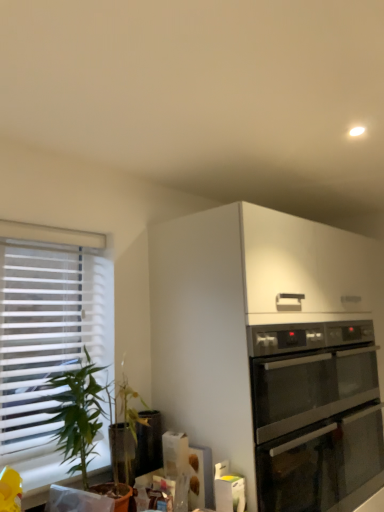
Question: Could you tell me if green leafy plant at left is turned towards satin silver oven at upper right?

Choices:
 (A) yes
 (B) no

Answer: (B)

Question: From a real-world perspective, is green leafy plant at left on top of satin silver oven at upper right?

Choices:
 (A) no
 (B) yes

Answer: (B)

Question: Can you confirm if green leafy plant at left is positioned to the left of satin silver oven at upper right?

Choices:
 (A) yes
 (B) no

Answer: (A)

Question: Can you confirm if green leafy plant at left is shorter than satin silver oven at upper right?

Choices:
 (A) no
 (B) yes

Answer: (B)

Question: Considering the relative sizes of green leafy plant at left and satin silver oven at upper right in the image provided, is green leafy plant at left taller than satin silver oven at upper right?

Choices:
 (A) no
 (B) yes

Answer: (A)

Question: Is satin silver oven at upper right in front of or behind white blinds at left in the image?

Choices:
 (A) front
 (B) behind

Answer: (B)

Question: Is satin silver oven at upper right taller or shorter than white blinds at left?

Choices:
 (A) short
 (B) tall

Answer: (A)

Question: Is satin silver oven at upper right wider or thinner than white blinds at left?

Choices:
 (A) wide
 (B) thin

Answer: (A)

Question: In the image, is satin silver oven at upper right on the left side or the right side of white blinds at left?

Choices:
 (A) right
 (B) left

Answer: (A)

Question: Is point (91, 443) closer or farther from the camera than point (49, 402)?

Choices:
 (A) farther
 (B) closer

Answer: (B)

Question: Considering their positions, is green leafy plant at left located in front of or behind white blinds at left?

Choices:
 (A) front
 (B) behind

Answer: (A)

Question: Looking at the image, does green leafy plant at left seem bigger or smaller compared to white blinds at left?

Choices:
 (A) small
 (B) big

Answer: (B)

Question: Visually, is green leafy plant at left positioned to the left or to the right of white blinds at left?

Choices:
 (A) right
 (B) left

Answer: (A)

Question: From a real-world perspective, is stainless steel oven at lower right positioned above or below satin silver oven at upper right?

Choices:
 (A) below
 (B) above

Answer: (B)

Question: Is stainless steel oven at lower right taller or shorter than satin silver oven at upper right?

Choices:
 (A) short
 (B) tall

Answer: (A)